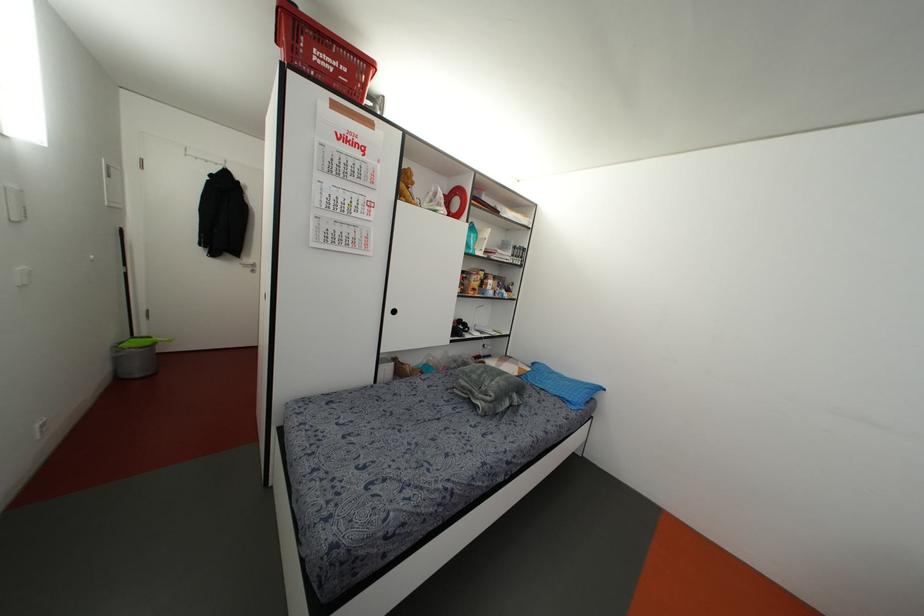
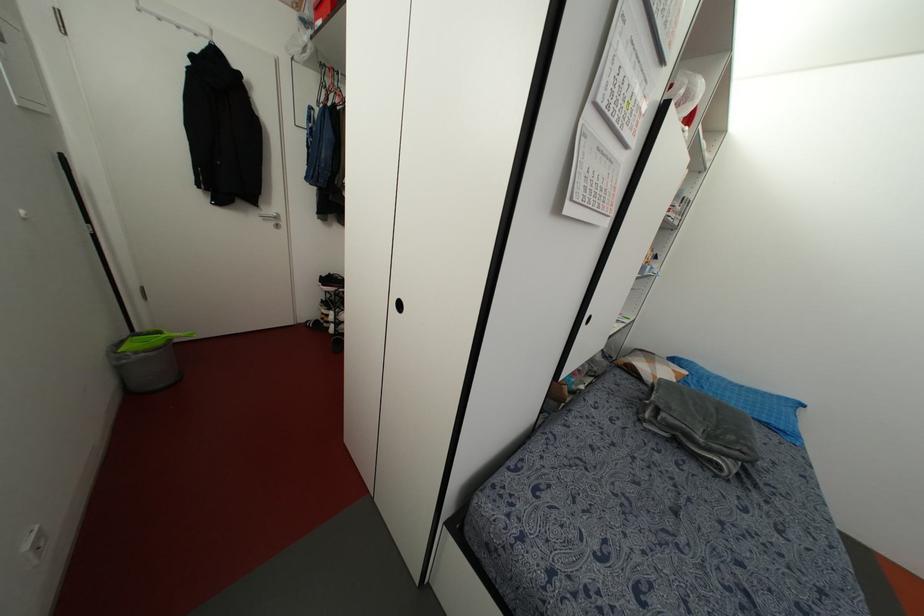
Find the pixel in the second image that matches (x=252, y=270) in the first image.

(276, 225)